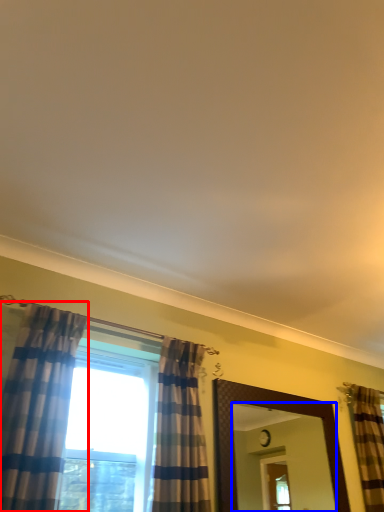
Question: Which point is closer to the camera, curtain (highlighted by a red box) or mirror (highlighted by a blue box)?

Choices:
 (A) curtain
 (B) mirror

Answer: (A)